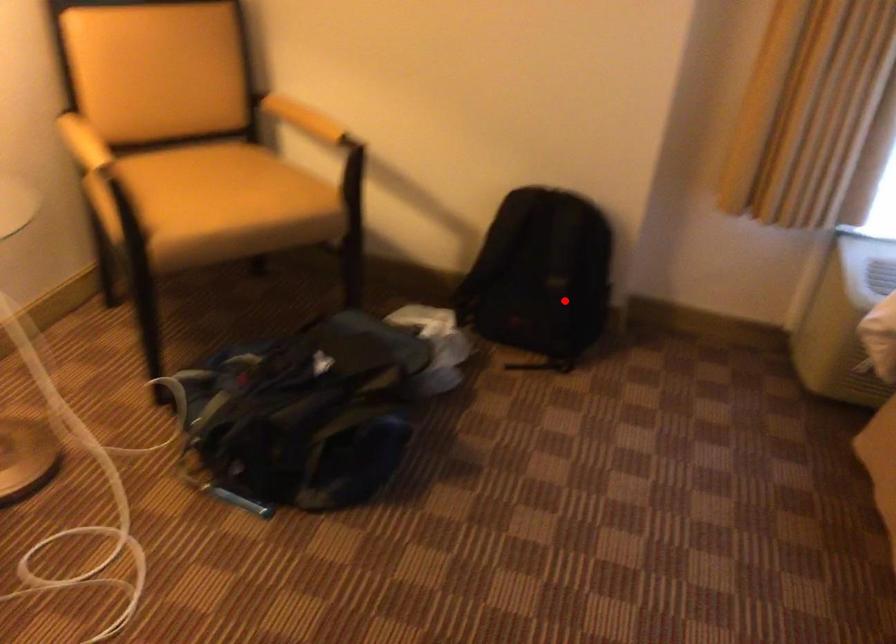
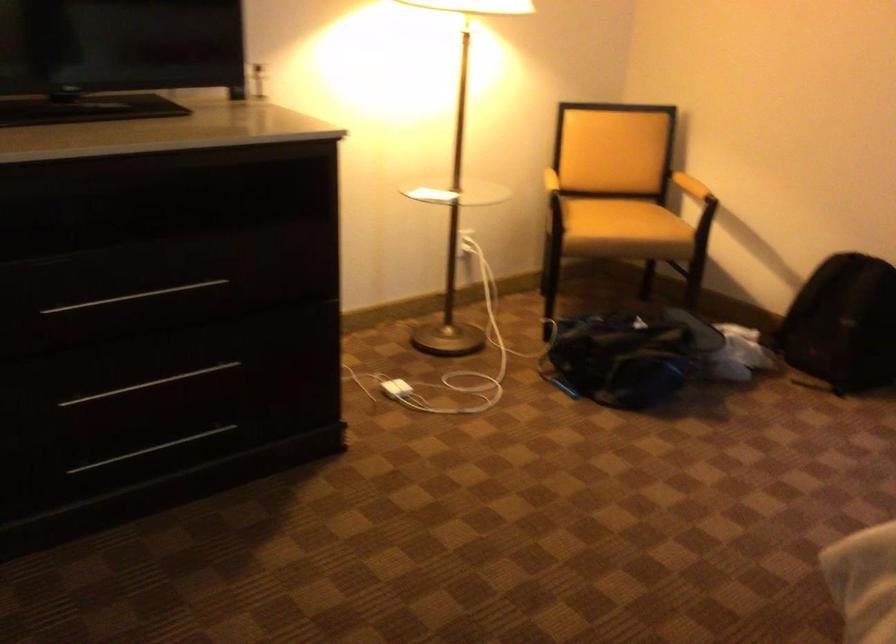
In the second image, find the point that corresponds to the highlighted location in the first image.

(842, 324)